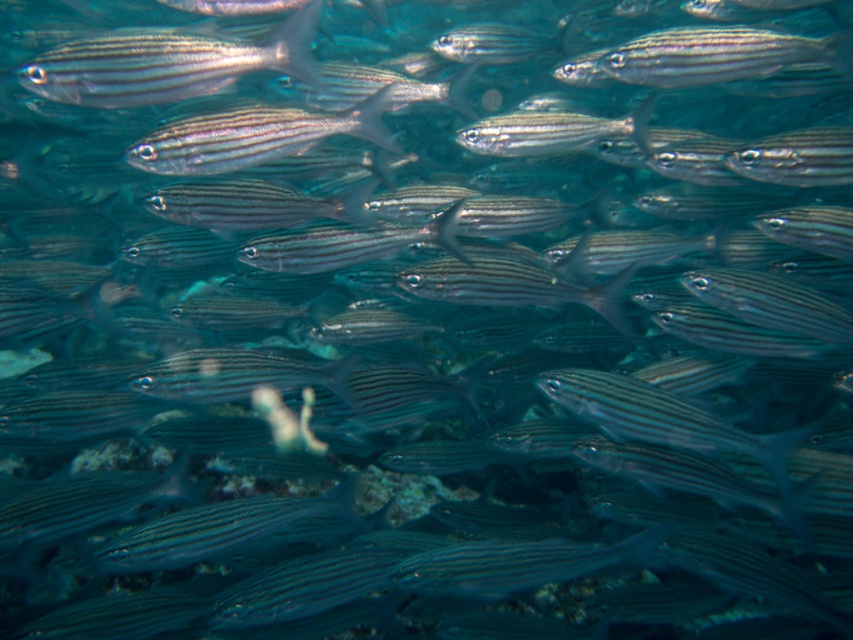
Question: Can you confirm if shiny silver fish at upper left is smaller than silvery striped fish at center?

Choices:
 (A) yes
 (B) no

Answer: (B)

Question: Among these objects, which one is farthest from the camera?

Choices:
 (A) silvery striped fish at center
 (B) shiny silver fish at upper left

Answer: (A)

Question: Can you confirm if shiny silver fish at upper left is positioned to the left of silvery striped fish at center?

Choices:
 (A) yes
 (B) no

Answer: (A)

Question: Is shiny silver fish at upper left positioned in front of silvery striped fish at center?

Choices:
 (A) no
 (B) yes

Answer: (B)